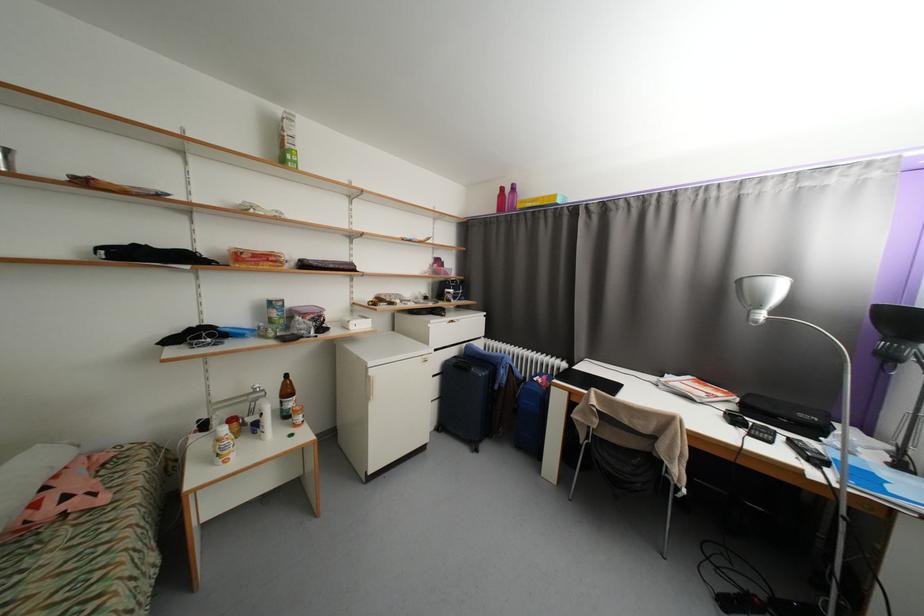
Describe the element at coordinates (760, 294) in the screenshot. The width and height of the screenshot is (924, 616). I see `the white lamp head` at that location.